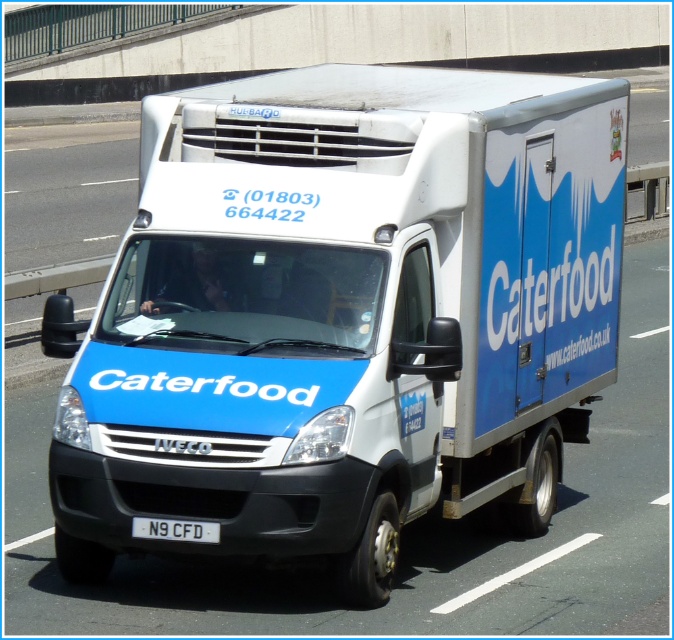
You are a photographer trying to capture the license plate of the blue matte truck at center. You have a camera that can only focus on objects wider than 10 cm. Can you get a clear photo of the white plastic license plate at center?

The blue matte truck at center is wider than the white plastic license plate at center. However, the question is about the license plate width. Since the truck is wider, but the license plate size isn not provided. The answer should not assume the license plate is smaller than 10 cm. The correct answer is that the description only states the truck is wider than the license plate, but does not provide specific measurements for the license plate. Therefore, it is unknown if the license plate is wider than 10m